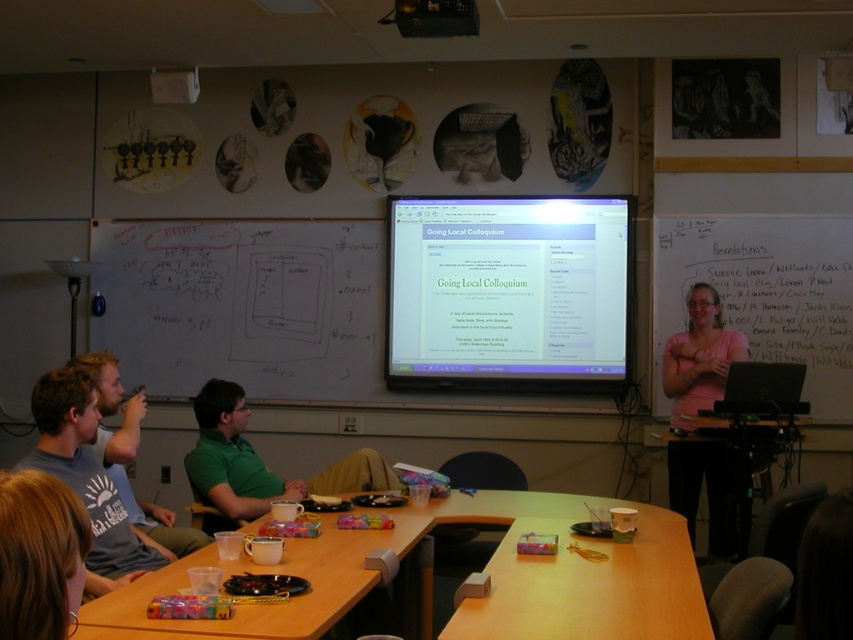
You are a student entering the classroom and see the wooden table at center and the green matte shirt at center. Which object is positioned lower in the image?

The wooden table at center is located below green matte shirt at center, so the wooden table at center is positioned lower in the image.

You are a student trying to reach the wooden table at center from your current position. There is a matte plastic projector screen at center in the way. Can you walk around the screen to reach the table?

The wooden table at center is behind the matte plastic projector screen at center, so you can walk around the screen to reach the table.